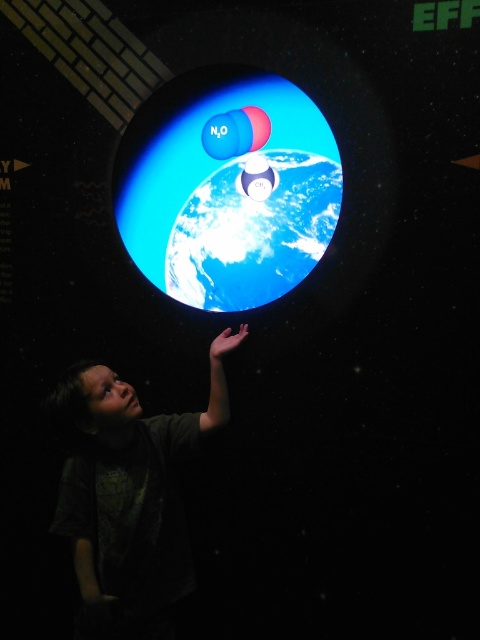
Question: Can you confirm if blue glossy sphere at center is positioned to the right of dark gray shirt at lower left?

Choices:
 (A) no
 (B) yes

Answer: (B)

Question: Among these points, which one is farthest from the camera?

Choices:
 (A) (251, 285)
 (B) (158, 560)

Answer: (A)

Question: From the image, what is the correct spatial relationship of blue glossy sphere at center in relation to dark gray shirt at lower left?

Choices:
 (A) below
 (B) above

Answer: (B)

Question: Which point is farther to the camera?

Choices:
 (A) (154, 598)
 (B) (288, 276)

Answer: (B)

Question: Is blue glossy sphere at center to the right of dark gray shirt at lower left from the viewer's perspective?

Choices:
 (A) no
 (B) yes

Answer: (B)